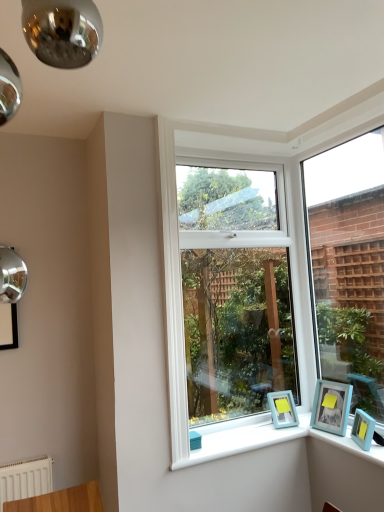
Question: Should I look upward or downward to see light blue plastic picture frame at lower right, which ranks as the second picture frame in left-to-right order?

Choices:
 (A) up
 (B) down

Answer: (B)

Question: Considering the relative sizes of clear glass window at right, which is counted as the 1th window, starting from the right, and teal matte picture frame at lower right, which appears as the third picture frame when viewed from the right, in the image provided, is clear glass window at right, which is counted as the 1th window, starting from the right, shorter than teal matte picture frame at lower right, which appears as the third picture frame when viewed from the right,?

Choices:
 (A) yes
 (B) no

Answer: (B)

Question: From a real-world perspective, is clear glass window at right, which is counted as the 1th window, starting from the right, physically above teal matte picture frame at lower right, the 1th picture frame positioned from the left?

Choices:
 (A) no
 (B) yes

Answer: (B)

Question: Could you tell me if clear glass window at right, arranged as the second window when viewed from the left, is facing teal matte picture frame at lower right, the 1th picture frame positioned from the left?

Choices:
 (A) no
 (B) yes

Answer: (B)

Question: Is clear glass window at right, which is counted as the 1th window, starting from the right, smaller than teal matte picture frame at lower right, the 1th picture frame positioned from the left?

Choices:
 (A) no
 (B) yes

Answer: (A)

Question: Is clear glass window at right, arranged as the second window when viewed from the left, positioned beyond the bounds of teal matte picture frame at lower right, the 1th picture frame positioned from the left?

Choices:
 (A) no
 (B) yes

Answer: (B)

Question: Is clear glass window at right, arranged as the second window when viewed from the left, at the left side of teal matte picture frame at lower right, the 1th picture frame positioned from the left?

Choices:
 (A) yes
 (B) no

Answer: (B)

Question: Can you confirm if light blue plastic picture frame at lower right, which ranks as the second picture frame in left-to-right order, is bigger than teal matte picture frame at lower right, which appears as the third picture frame when viewed from the right?

Choices:
 (A) no
 (B) yes

Answer: (B)

Question: Is light blue plastic picture frame at lower right, which ranks as the second picture frame in left-to-right order, not near teal matte picture frame at lower right, which appears as the third picture frame when viewed from the right?

Choices:
 (A) no
 (B) yes

Answer: (A)

Question: From a real-world perspective, is light blue plastic picture frame at lower right, which ranks as the second picture frame in left-to-right order, below teal matte picture frame at lower right, the 1th picture frame positioned from the left?

Choices:
 (A) no
 (B) yes

Answer: (A)

Question: From the image's perspective, does light blue plastic picture frame at lower right, the second picture frame viewed from the right, appear higher than teal matte picture frame at lower right, which appears as the third picture frame when viewed from the right?

Choices:
 (A) no
 (B) yes

Answer: (B)

Question: Can you confirm if light blue plastic picture frame at lower right, which ranks as the second picture frame in left-to-right order, is positioned to the left of teal matte picture frame at lower right, which appears as the third picture frame when viewed from the right?

Choices:
 (A) yes
 (B) no

Answer: (B)

Question: Can you confirm if light blue plastic picture frame at lower right, the second picture frame viewed from the right, is shorter than teal matte picture frame at lower right, which appears as the third picture frame when viewed from the right?

Choices:
 (A) no
 (B) yes

Answer: (A)

Question: Can you confirm if light blue plastic picture frame at lower right, which ranks as the second picture frame in left-to-right order, is smaller than light blue plastic picture frame at lower right, the 3th picture frame viewed from the left?

Choices:
 (A) yes
 (B) no

Answer: (B)